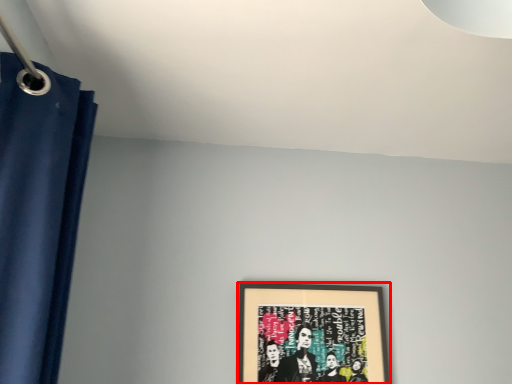
Question: From the image, what is the correct spatial relationship of picture frame (annotated by the red box) in relation to curtain?

Choices:
 (A) right
 (B) left

Answer: (A)